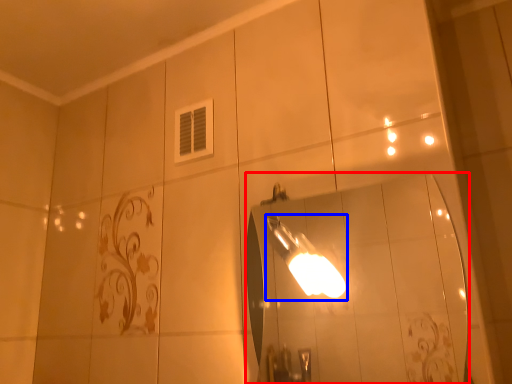
Question: Which object is closer to the camera taking this photo, mirror (highlighted by a red box) or light fixture (highlighted by a blue box)?

Choices:
 (A) mirror
 (B) light fixture

Answer: (A)